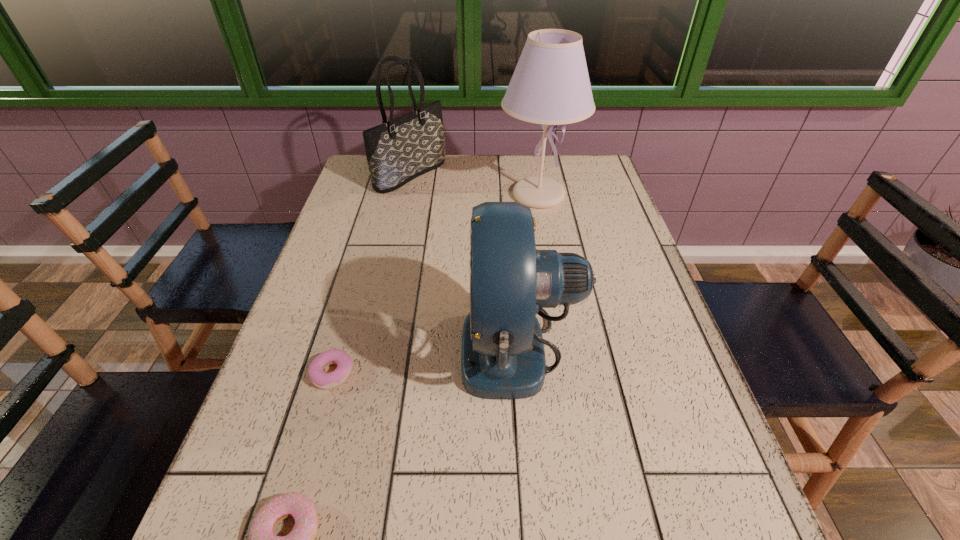
Locate an element on the screen. Image resolution: width=960 pixels, height=540 pixels. lampshade that is at the far edge is located at coordinates coord(550,86).

Image resolution: width=960 pixels, height=540 pixels. I want to click on tote bag at the far edge, so click(x=399, y=150).

Find the location of a particular element. This screenshot has width=960, height=540. tote bag present at the left edge is located at coordinates pyautogui.click(x=399, y=150).

Locate an element on the screen. The width and height of the screenshot is (960, 540). pastry that is positioned at the left edge is located at coordinates (321, 379).

Where is `object at the right edge`? object at the right edge is located at coordinates (550, 86).

The width and height of the screenshot is (960, 540). Find the location of `object positioned at the far left corner`. object positioned at the far left corner is located at coordinates (399, 150).

What are the coordinates of `object situated at the far right corner` in the screenshot? It's located at click(x=550, y=86).

Image resolution: width=960 pixels, height=540 pixels. Identify the location of vacant space at the far edge of the desktop. (408, 184).

At what (x,y) coordinates should I click in order to perform the action: click on vacant area at the left edge. Please return your answer as a coordinate pair (x, y). Looking at the image, I should click on (276, 367).

Identify the location of free location at the right edge of the desktop. Image resolution: width=960 pixels, height=540 pixels. (598, 241).